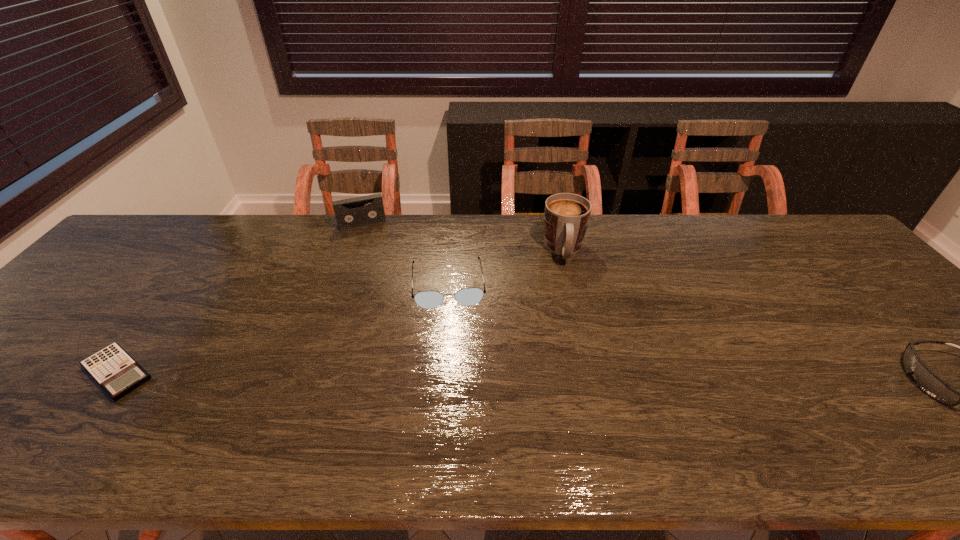
At what (x,y) coordinates should I click in order to perform the action: click on calculator. Please return your answer as a coordinate pair (x, y). This screenshot has width=960, height=540. Looking at the image, I should click on (118, 374).

Image resolution: width=960 pixels, height=540 pixels. I want to click on the leftmost object, so click(118, 374).

Image resolution: width=960 pixels, height=540 pixels. Find the location of `the second object from right to left`. the second object from right to left is located at coordinates (566, 216).

Where is `the tallest object`? This screenshot has height=540, width=960. the tallest object is located at coordinates (566, 216).

Identify the location of the third object from right to left. This screenshot has height=540, width=960. (468, 296).

You are a GUI agent. You are given a task and a screenshot of the screen. Output one action in this format:
    pyautogui.click(x=<x>, y=<y>)
    Task: Click on the second object from left to right
    This screenshot has height=540, width=960.
    Given the screenshot: What is the action you would take?
    pyautogui.click(x=353, y=212)

I want to click on the farthest object, so click(353, 212).

Find the location of a particular element. This screenshot has height=540, width=960. vacant space located 0.300m on the back of the shortest object is located at coordinates (198, 266).

Identify the location of free space located on the side of the fourth object from left to right with the handle. This screenshot has height=540, width=960. (574, 335).

Find the location of a particular element. The width and height of the screenshot is (960, 540). free space located on the side of the fourth object from left to right with the handle is located at coordinates (575, 348).